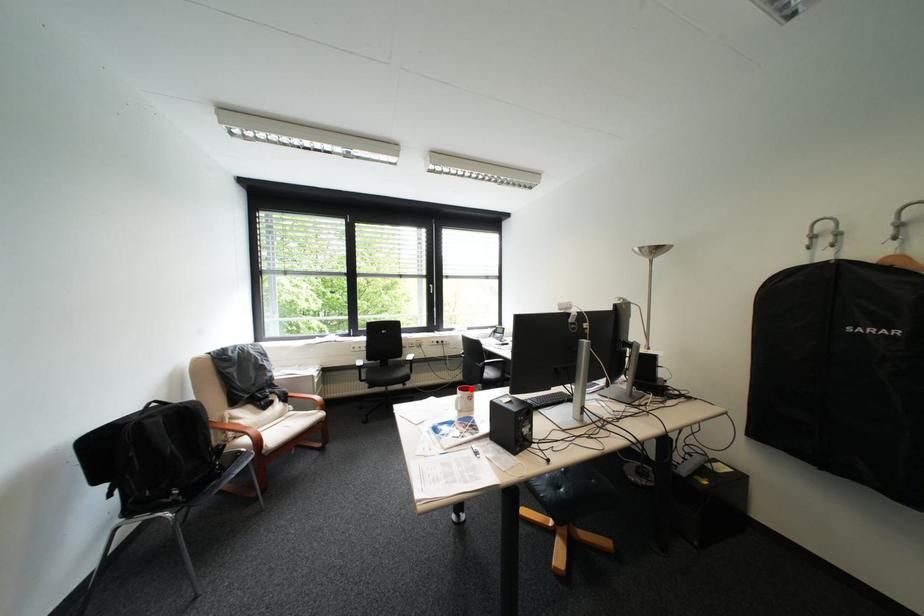
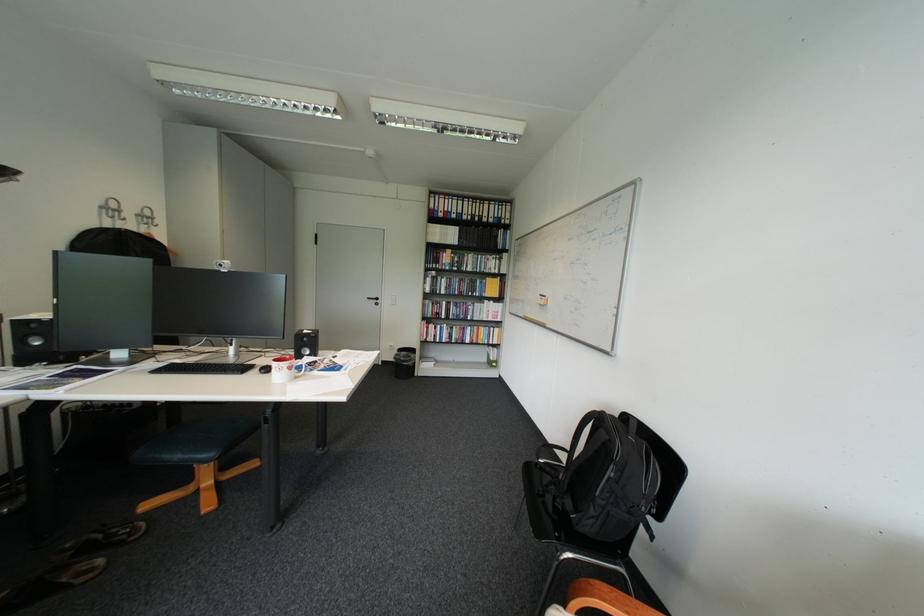
The point at the highlighted location is marked in the first image. Where is the corresponding point in the second image?

(299, 362)